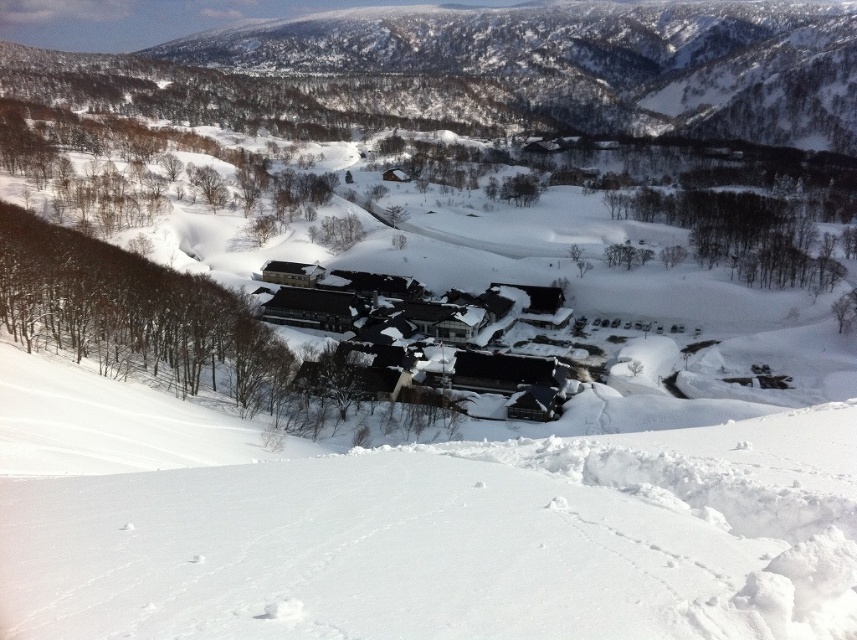
Can you confirm if white snow at lower center is wider than black shingled roofs at center?

In fact, white snow at lower center might be narrower than black shingled roofs at center.

Is white snow at lower center shorter than black shingled roofs at center?

Yes.

Which is in front, point (520, 636) or point (537, 320)?

Point (520, 636)

I want to click on white snow at lower center, so click(x=454, y=541).